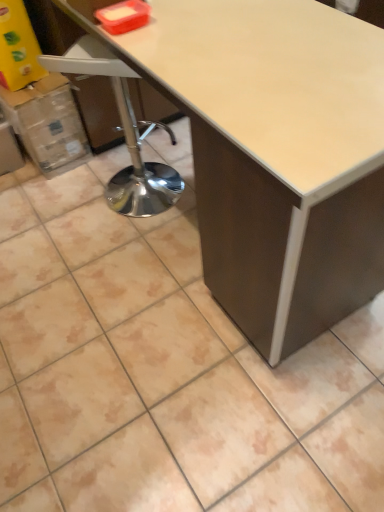
At what (x,y) coordinates should I click in order to perform the action: click on free area in between white plastic swivel chair at left and matte white table at center. Please return your answer as a coordinate pair (x, y). This screenshot has height=512, width=384. Looking at the image, I should click on (154, 252).